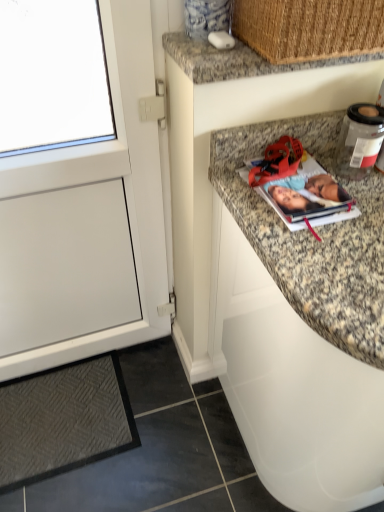
Identify the location of vacant space to the right of dark gray textured mat at lower left. (173, 426).